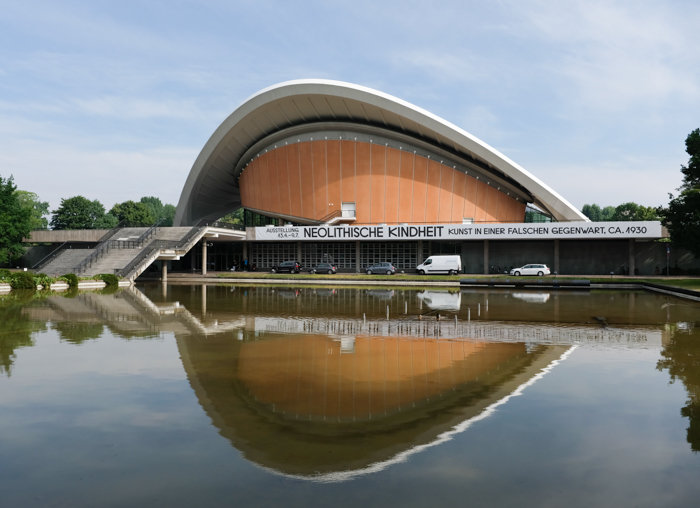
I want to click on wall, so click(332, 180).